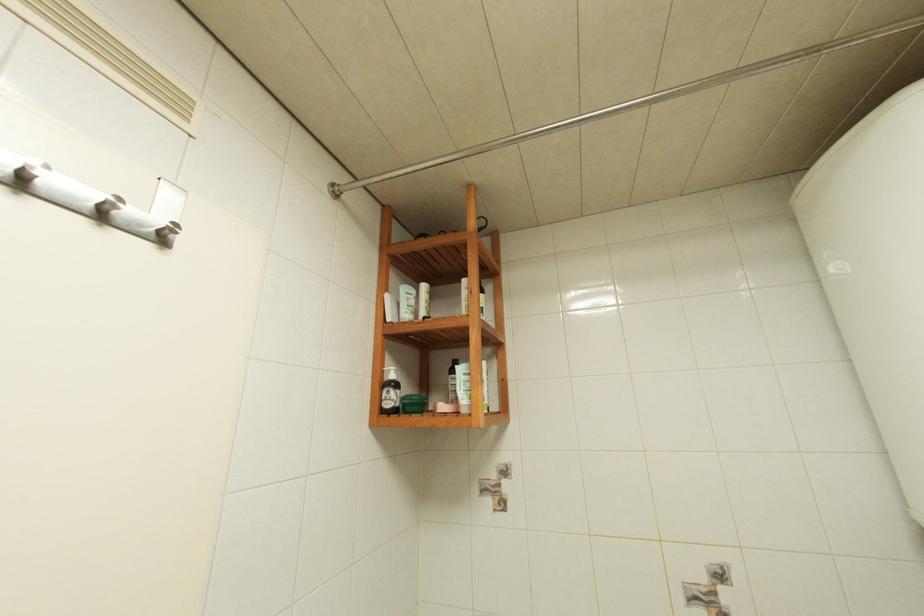
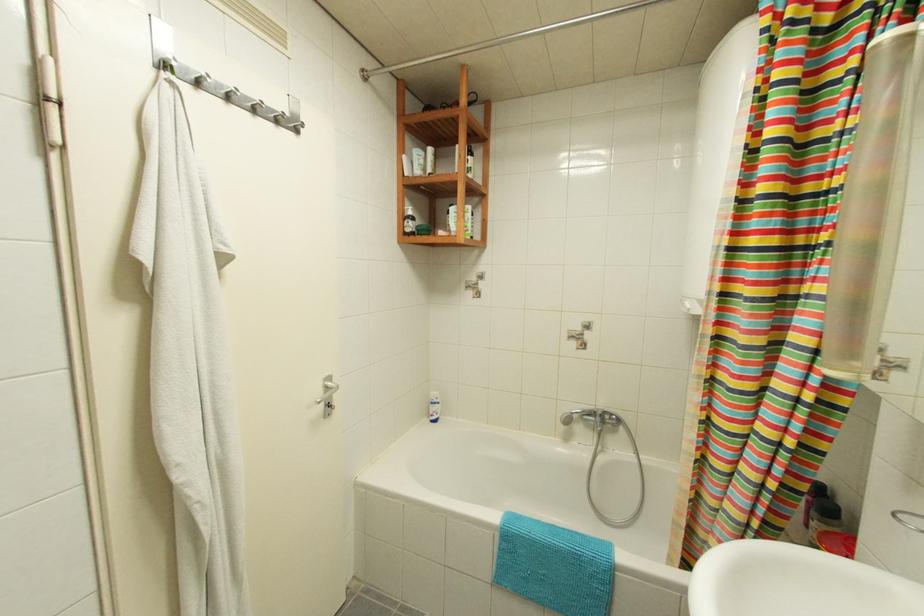
Question: The first image is from the beginning of the video and the second image is from the end. How did the camera likely rotate when shooting the video?

Choices:
 (A) Left
 (B) Right
 (C) Up
 (D) Down

Answer: (D)